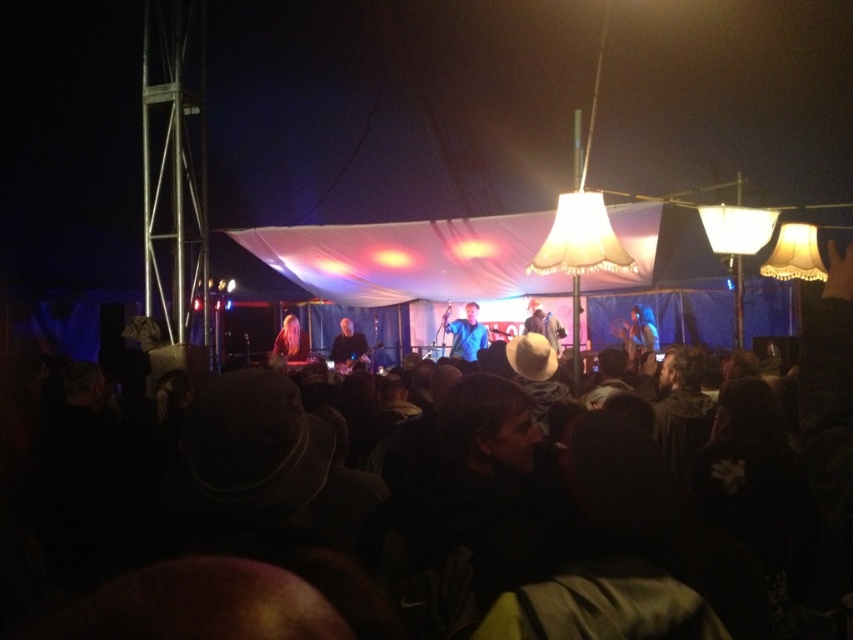
Can you confirm if smooth black guitar at center is thinner than white matte cowboy hat at center?

No.

Does point (350, 356) come closer to viewer compared to point (556, 333)?

No, (350, 356) is further to viewer.

The image size is (853, 640). Identify the location of smooth black guitar at center. (347, 348).

How far apart are blue fabric at center and blonde hair at center?

blue fabric at center and blonde hair at center are 8.43 feet apart from each other.

Does blue fabric at center have a lesser width compared to blonde hair at center?

No, blue fabric at center is not thinner than blonde hair at center.

At what (x,y) coordinates should I click in order to perform the action: click on blue fabric at center. Please return your answer as a coordinate pair (x, y). This screenshot has width=853, height=640. Looking at the image, I should click on (465, 332).

You are a GUI agent. You are given a task and a screenshot of the screen. Output one action in this format:
    pyautogui.click(x=<x>, y=<y>)
    Task: Click on the blue fabric at center
    The width and height of the screenshot is (853, 640).
    Given the screenshot: What is the action you would take?
    pyautogui.click(x=465, y=332)

Does shiny blue guitar at center have a greater width compared to blonde hair at center?

Yes.

In the scene shown: Between shiny blue guitar at center and blonde hair at center, which one appears on the right side from the viewer's perspective?

shiny blue guitar at center is more to the right.

Which is behind, point (634, 333) or point (303, 353)?

Point (303, 353)

Identify the location of shiny blue guitar at center. (639, 332).